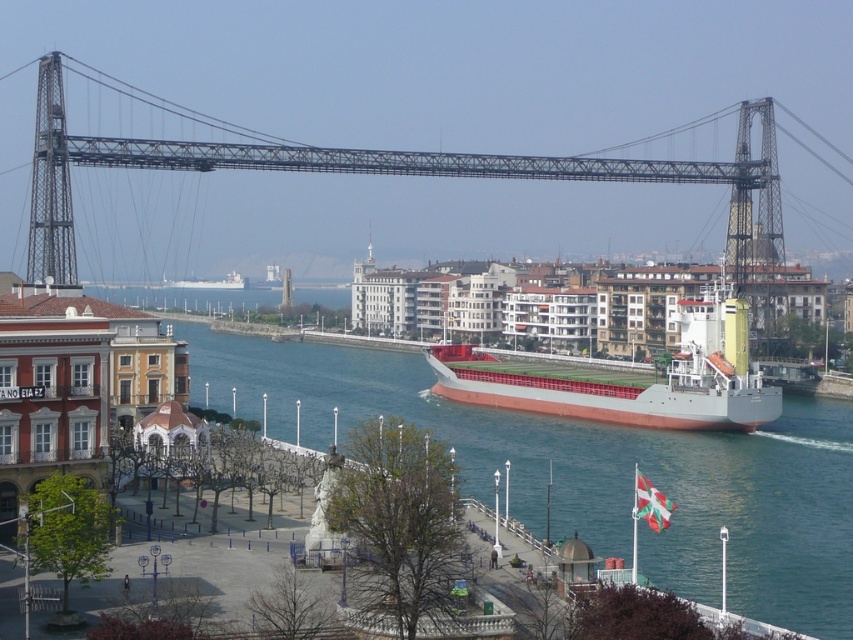
Locate an element on the screen. metallic suspension bridge at center is located at coordinates (402, 173).

Does metallic suspension bridge at center have a lesser width compared to red matte cargo ship at center?

No.

This screenshot has height=640, width=853. In order to click on metallic suspension bridge at center in this screenshot , I will do 402,173.

Locate an element on the screen. The height and width of the screenshot is (640, 853). metallic suspension bridge at center is located at coordinates (402, 173).